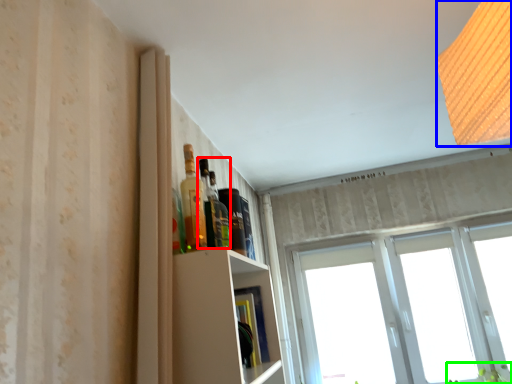
Question: Estimate the real-world distances between objects in this image. Which object is farther from bottle (highlighted by a red box), light (highlighted by a blue box) or plant (highlighted by a green box)?

Choices:
 (A) light
 (B) plant

Answer: (B)